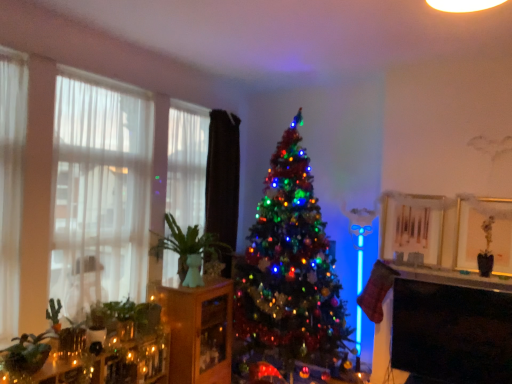
Question: Does iridescent glass christmas tree at center appear on the right side of green ceramic vase at left?

Choices:
 (A) no
 (B) yes

Answer: (B)

Question: Could you tell me if iridescent glass christmas tree at center is turned towards green ceramic vase at left?

Choices:
 (A) no
 (B) yes

Answer: (A)

Question: Considering the relative sizes of iridescent glass christmas tree at center and green ceramic vase at left in the image provided, is iridescent glass christmas tree at center thinner than green ceramic vase at left?

Choices:
 (A) no
 (B) yes

Answer: (A)

Question: Does iridescent glass christmas tree at center have a greater width compared to green ceramic vase at left?

Choices:
 (A) no
 (B) yes

Answer: (B)

Question: From a real-world perspective, is iridescent glass christmas tree at center physically above green ceramic vase at left?

Choices:
 (A) yes
 (B) no

Answer: (A)

Question: Can you confirm if iridescent glass christmas tree at center is taller than green ceramic vase at left?

Choices:
 (A) no
 (B) yes

Answer: (B)

Question: Would you say green matte plant at lower left is a long distance from matte glass candle at lower left?

Choices:
 (A) yes
 (B) no

Answer: (B)

Question: From the image's perspective, is green matte plant at lower left located above matte glass candle at lower left?

Choices:
 (A) yes
 (B) no

Answer: (A)

Question: Does green matte plant at lower left have a lesser height compared to matte glass candle at lower left?

Choices:
 (A) yes
 (B) no

Answer: (A)

Question: Is green matte plant at lower left looking in the opposite direction of matte glass candle at lower left?

Choices:
 (A) yes
 (B) no

Answer: (B)

Question: Is matte glass candle at lower left a part of green matte plant at lower left?

Choices:
 (A) yes
 (B) no

Answer: (B)

Question: From a real-world perspective, is green matte plant at lower left positioned under matte glass candle at lower left based on gravity?

Choices:
 (A) no
 (B) yes

Answer: (A)

Question: Does green ceramic vase at left have a greater height compared to black glossy tv at lower right?

Choices:
 (A) no
 (B) yes

Answer: (A)